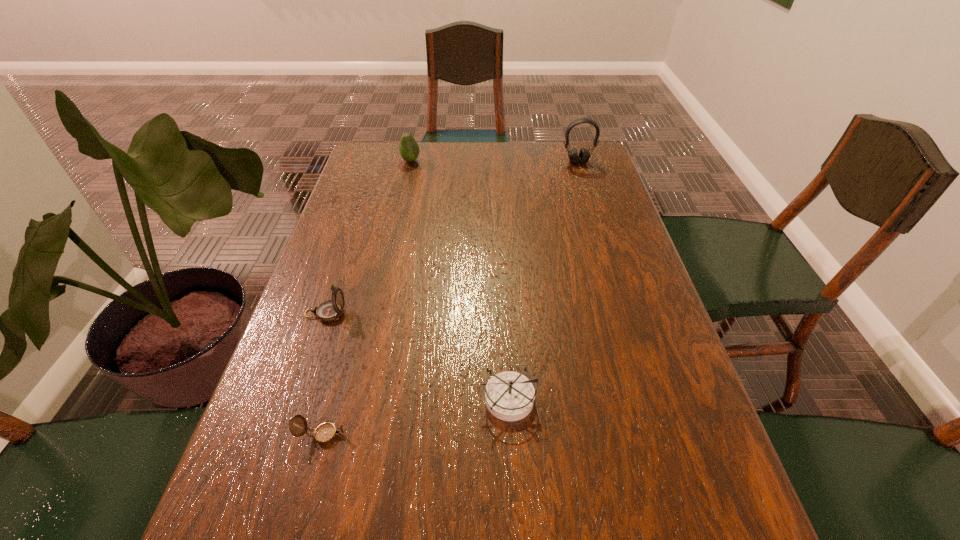
You are a GUI agent. You are given a task and a screenshot of the screen. Output one action in this format:
    pyautogui.click(x=<x>, y=<y>)
    Task: Click on the rightmost object
    
    Given the screenshot: What is the action you would take?
    pyautogui.click(x=584, y=154)

Find the location of a particular element. the tallest object is located at coordinates (584, 154).

This screenshot has width=960, height=540. Identify the location of avocado. (409, 150).

Locate an element on the screen. The image size is (960, 540). the tallest compass is located at coordinates (330, 310).

This screenshot has height=540, width=960. In order to click on the farthest compass in this screenshot , I will do `click(330, 310)`.

In order to click on the fourth tallest object in this screenshot , I will do `click(509, 396)`.

Locate an element on the screen. The width and height of the screenshot is (960, 540). the second nearest object is located at coordinates (509, 396).

Where is `the nearest compass`? The image size is (960, 540). the nearest compass is located at coordinates (325, 433).

You are a GUI agent. You are given a task and a screenshot of the screen. Output one action in this format:
    pyautogui.click(x=<x>, y=<y>)
    Task: Click on the nearest object
    This screenshot has width=960, height=540.
    Given the screenshot: What is the action you would take?
    [x=325, y=433]

What are the coordinates of `vacant area situated 0.090m on the front-facing side of the tallest object` in the screenshot? It's located at coord(584,180).